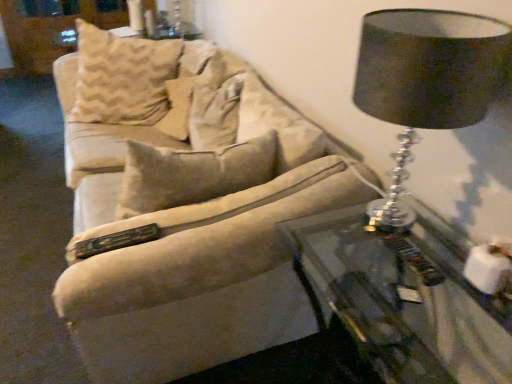
This screenshot has width=512, height=384. What are the coordinates of `beige fabric pillow at center` in the screenshot? It's located at (189, 85).

Describe the element at coordinates (52, 28) in the screenshot. I see `white fabric dresser at upper left` at that location.

This screenshot has height=384, width=512. I want to click on black fabric lampshade at upper right, so click(x=431, y=67).

Who is bigger, beige fabric pillow at center or black fabric lampshade at upper right?

beige fabric pillow at center.

Is beige fabric pillow at center looking in the opposite direction of black fabric lampshade at upper right?

No.

Is beige fabric pillow at center thinner than black fabric lampshade at upper right?

In fact, beige fabric pillow at center might be wider than black fabric lampshade at upper right.

Which is less distant, (375, 310) or (172, 113)?

Point (375, 310) is closer to the camera than point (172, 113).

Considering the positions of objects transparent glass table at lower right and beige fabric pillow at center in the image provided, who is in front, transparent glass table at lower right or beige fabric pillow at center?

transparent glass table at lower right.

Is transparent glass table at lower right to the left of beige fabric pillow at center from the viewer's perspective?

No.

What's the angular difference between transparent glass table at lower right and beige fabric pillow at center's facing directions?

The angle between the facing direction of transparent glass table at lower right and the facing direction of beige fabric pillow at center is 17.2 degrees.

Does transparent glass table at lower right turn towards white fabric dresser at upper left?

No, transparent glass table at lower right is not facing towards white fabric dresser at upper left.

From the image's perspective, is transparent glass table at lower right on white fabric dresser at upper left?

No, from the image's perspective, transparent glass table at lower right is not on top of white fabric dresser at upper left.

Which is behind, transparent glass table at lower right or white fabric dresser at upper left?

white fabric dresser at upper left is behind.

Which of these two, transparent glass table at lower right or white fabric dresser at upper left, is smaller?

With smaller size is white fabric dresser at upper left.

Considering the points (157, 124) and (399, 347), which point is behind, point (157, 124) or point (399, 347)?

The point (157, 124) is more distant.

From the image's perspective, does beige fabric pillow at center appear lower than transparent glass table at lower right?

No, from the image's perspective, beige fabric pillow at center is not beneath transparent glass table at lower right.

Where is `table in front of the beige fabric pillow at center`? Image resolution: width=512 pixels, height=384 pixels. table in front of the beige fabric pillow at center is located at coordinates (406, 297).

From a real-world perspective, is beige fabric pillow at center physically above transparent glass table at lower right?

Yes, from a real-world perspective, beige fabric pillow at center is over transparent glass table at lower right

From a real-world perspective, is white fabric dresser at upper left positioned over black fabric lampshade at upper right based on gravity?

Incorrect, from a real-world perspective, white fabric dresser at upper left is lower than black fabric lampshade at upper right.

Is white fabric dresser at upper left positioned with its back to black fabric lampshade at upper right?

No.

Is white fabric dresser at upper left bigger or smaller than black fabric lampshade at upper right?

white fabric dresser at upper left is bigger than black fabric lampshade at upper right.

From the image's perspective, who appears lower, black fabric lampshade at upper right or beige fabric pillow at center?

From the image's view, black fabric lampshade at upper right is below.

Who is shorter, black fabric lampshade at upper right or beige fabric pillow at center?

beige fabric pillow at center.

Is point (409, 16) farther from camera compared to point (218, 80)?

No, (409, 16) is closer to viewer.

What's the angular difference between black fabric lampshade at upper right and beige fabric pillow at center's facing directions?

15.4 degrees separate the facing orientations of black fabric lampshade at upper right and beige fabric pillow at center.

Can white fabric dresser at upper left be found inside black fabric lampshade at upper right?

No.

Based on the photo, considering the relative positions of black fabric lampshade at upper right and white fabric dresser at upper left in the image provided, is black fabric lampshade at upper right behind white fabric dresser at upper left?

No, black fabric lampshade at upper right is closer to the camera.

Considering the relative sizes of black fabric lampshade at upper right and white fabric dresser at upper left in the image provided, is black fabric lampshade at upper right shorter than white fabric dresser at upper left?

Indeed, black fabric lampshade at upper right has a lesser height compared to white fabric dresser at upper left.

How different are the orientations of black fabric lampshade at upper right and white fabric dresser at upper left in degrees?

There is a 90-degree angle between the facing directions of black fabric lampshade at upper right and white fabric dresser at upper left.

Locate an element on the screen. The image size is (512, 384). pillow on the left of black fabric lampshade at upper right is located at coordinates (189, 85).

What are the coordinates of `pillow above the transparent glass table at lower right (from the image's perspective)` in the screenshot? It's located at (189, 85).

From the image, which object appears to be farther from white fabric dresser at upper left, beige fabric pillow at center or black fabric lampshade at upper right?

The object further to white fabric dresser at upper left is black fabric lampshade at upper right.

Considering their positions, is transparent glass table at lower right positioned closer to black fabric lampshade at upper right than beige fabric pillow at center?

transparent glass table at lower right is closer to black fabric lampshade at upper right.

From the image, which object appears to be farther from beige fabric pillow at center, transparent glass table at lower right or black fabric lampshade at upper right?

black fabric lampshade at upper right lies further to beige fabric pillow at center than the other object.

Looking at this image, estimate the real-world distances between objects in this image. Which object is further from transparent glass table at lower right, beige fabric pillow at center or white fabric dresser at upper left?

Among the two, white fabric dresser at upper left is located further to transparent glass table at lower right.

When comparing their distances from black fabric lampshade at upper right, does beige fabric pillow at center or transparent glass table at lower right seem closer?

Based on the image, transparent glass table at lower right appears to be nearer to black fabric lampshade at upper right.

Based on the photo, based on their spatial positions, is white fabric dresser at upper left or beige fabric pillow at center further from transparent glass table at lower right?

The object further to transparent glass table at lower right is white fabric dresser at upper left.

Considering their positions, is black fabric lampshade at upper right positioned further to transparent glass table at lower right than white fabric dresser at upper left?

Based on the image, white fabric dresser at upper left appears to be further to transparent glass table at lower right.

From the picture: Based on their spatial positions, is white fabric dresser at upper left or transparent glass table at lower right further from beige fabric pillow at center?

Based on the image, white fabric dresser at upper left appears to be further to beige fabric pillow at center.

Locate an element on the screen. This screenshot has width=512, height=384. pillow between black fabric lampshade at upper right and white fabric dresser at upper left along the z-axis is located at coordinates (189, 85).

At what (x,y) coordinates should I click in order to perform the action: click on lamp between transparent glass table at lower right and beige fabric pillow at center along the z-axis. Please return your answer as a coordinate pair (x, y). Looking at the image, I should click on (431, 67).

Locate an element on the screen. The image size is (512, 384). pillow between transparent glass table at lower right and white fabric dresser at upper left in the front-back direction is located at coordinates (189, 85).

In order to click on lamp between transparent glass table at lower right and white fabric dresser at upper left along the z-axis in this screenshot , I will do `click(431, 67)`.